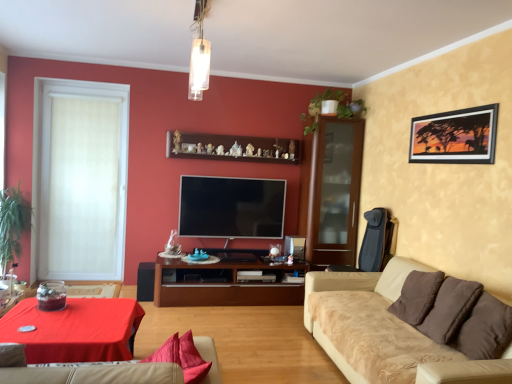
Question: From the image's perspective, relative to matte black speaker at lower left, is green leafy plant at left, placed as the 2th plant when sorted from right to left, above or below?

Choices:
 (A) above
 (B) below

Answer: (A)

Question: Is green leafy plant at left, placed as the 2th plant when sorted from top to bottom, situated inside matte black speaker at lower left or outside?

Choices:
 (A) outside
 (B) inside

Answer: (A)

Question: Estimate the real-world distances between objects in this image. Which object is farther from the white textured window at left?

Choices:
 (A) transparent glass cabinet at right
 (B) wooden shelf at upper center
 (C) wooden cabinet at center
 (D) beige fabric couch at lower center, placed as the 2th studio couch when sorted from right to left
 (E) matte black speaker at lower left

Answer: (D)

Question: Which object is positioned closest to the green leafy plant at left, placed as the 2th plant when sorted from right to left?

Choices:
 (A) smooth red tablecloth at lower left
 (B) wooden cabinet at center
 (C) beige fabric couch at lower right, marked as the first studio couch in a right-to-left arrangement
 (D) transparent glass cabinet at right
 (E) white glass pendant light at upper center

Answer: (B)